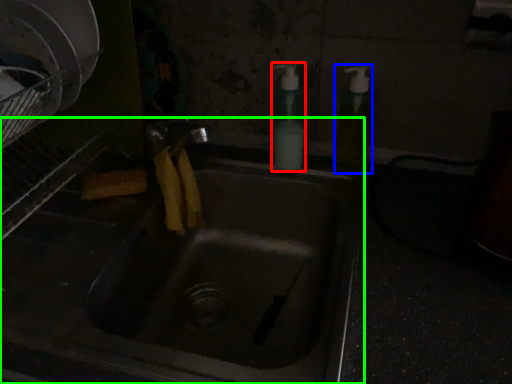
Question: Considering the real-world distances, which object is farthest from soap dispenser (highlighted by a red box)? soap dispenser (highlighted by a blue box) or sink (highlighted by a green box)?

Choices:
 (A) soap dispenser
 (B) sink

Answer: (B)